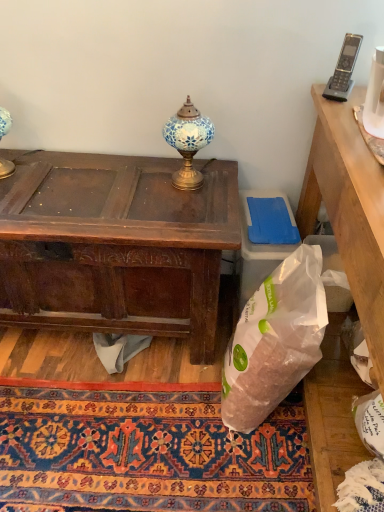
Where is `vacant space to the left of blue mosaic lamp at center`? vacant space to the left of blue mosaic lamp at center is located at coordinates (142, 177).